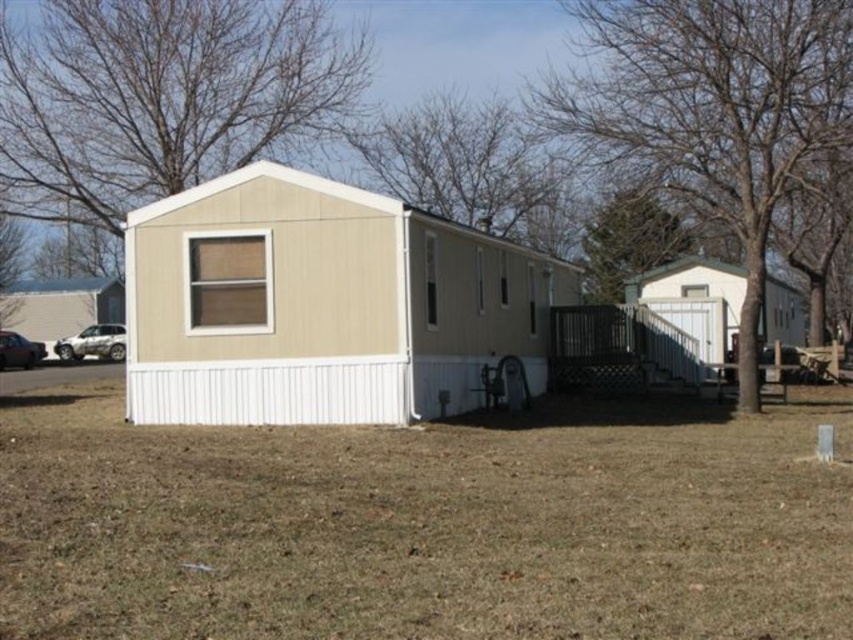
You are standing in front of the mobile home and notice a point marked at coordinates (160, 97). What does this point represent?

The point at (160, 97) represents the beige wood tree at upper left.

Based on the scene described, which tree, the beige wood tree at upper left or the brown textured tree at upper center, is closer to the ground?

The brown textured tree at upper center is closer to the ground since it is shorter than the beige wood tree at upper left.